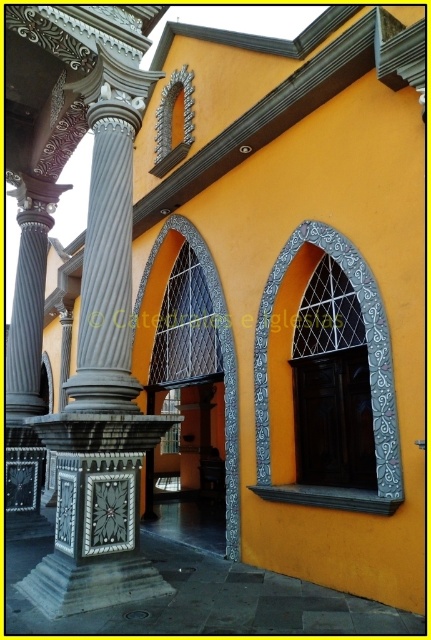
Looking at this image, between silver textured frame at center and silver metallic archway at center, which one appears on the right side from the viewer's perspective?

silver textured frame at center is more to the right.

Between silver textured frame at center and silver metallic archway at center, which one is positioned lower?

silver textured frame at center is below.

Between point (268, 324) and point (218, 280), which one is positioned behind?

The point (218, 280) is more distant.

Where is `silver textured frame at center`? The image size is (431, 640). silver textured frame at center is located at coordinates (369, 381).